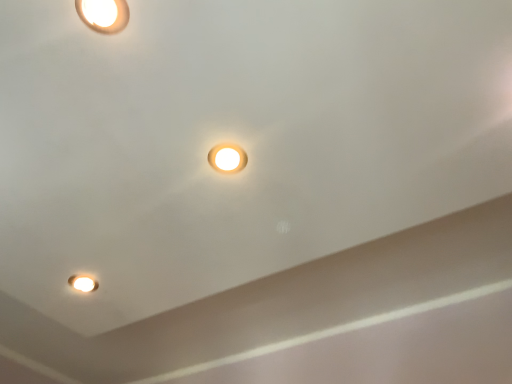
This screenshot has width=512, height=384. Identify the location of matte white light fixture at lower left. (83, 283).

Is matte white lamp at upper left, placed as the first lamp when sorted from front to back, far away from matte white lamp at center, acting as the second lamp starting from the left?

No, matte white lamp at upper left, placed as the first lamp when sorted from front to back, is not far from matte white lamp at center, acting as the second lamp starting from the left.

Does matte white lamp at upper left, which is counted as the 2th lamp, starting from the back, appear on the right side of matte white lamp at center, arranged as the 1th lamp when viewed from the right?

Incorrect, matte white lamp at upper left, which is counted as the 2th lamp, starting from the back, is not on the right side of matte white lamp at center, arranged as the 1th lamp when viewed from the right.

Does matte white lamp at upper left, acting as the 2th lamp starting from the right, have a greater width compared to matte white lamp at center, acting as the second lamp starting from the left?

Yes.

Does matte white lamp at upper left, placed as the first lamp when sorted from front to back, have a greater height compared to matte white lamp at center, arranged as the 1th lamp when viewed from the right?

Correct, matte white lamp at upper left, placed as the first lamp when sorted from front to back, is much taller as matte white lamp at center, arranged as the 1th lamp when viewed from the right.

Does matte white lamp at center, acting as the second lamp starting from the left, have a smaller size compared to matte white light fixture at lower left?

Yes, matte white lamp at center, acting as the second lamp starting from the left, is smaller than matte white light fixture at lower left.

Would you say matte white light fixture at lower left is part of matte white lamp at center, which is the 2th lamp in top-to-bottom order,'s contents?

No, matte white light fixture at lower left is located outside of matte white lamp at center, which is the 2th lamp in top-to-bottom order.

Is matte white lamp at center, arranged as the 1th lamp when viewed from the right, positioned before matte white light fixture at lower left?

That is True.

Is matte white lamp at center, the second lamp positioned from the front, oriented towards matte white light fixture at lower left?

No, matte white lamp at center, the second lamp positioned from the front, does not turn towards matte white light fixture at lower left.

In the image, is matte white lamp at upper left, placed as the first lamp when sorted from front to back, positioned in front of or behind matte white light fixture at lower left?

matte white lamp at upper left, placed as the first lamp when sorted from front to back, is positioned closer to the viewer than matte white light fixture at lower left.

Considering the positions of point (121, 30) and point (74, 286), is point (121, 30) closer or farther from the camera than point (74, 286)?

Point (121, 30) is closer to the camera than point (74, 286).

Is matte white lamp at upper left, the first lamp from the top, bigger or smaller than matte white light fixture at lower left?

Considering their sizes, matte white lamp at upper left, the first lamp from the top, takes up more space than matte white light fixture at lower left.

Where is `lamp that is the 2nd one when counting upward from the matte white light fixture at lower left (from the image's perspective)`? Image resolution: width=512 pixels, height=384 pixels. lamp that is the 2nd one when counting upward from the matte white light fixture at lower left (from the image's perspective) is located at coordinates (104, 14).

Who is taller, matte white light fixture at lower left or matte white lamp at upper left, which appears as the second lamp when ordered from the bottom?

matte white light fixture at lower left.

Considering the sizes of objects matte white light fixture at lower left and matte white lamp at upper left, which appears as the second lamp when ordered from the bottom, in the image provided, who is smaller, matte white light fixture at lower left or matte white lamp at upper left, which appears as the second lamp when ordered from the bottom,?

matte white light fixture at lower left.

From the picture: From a real-world perspective, is matte white light fixture at lower left positioned above or below matte white lamp at upper left, which is counted as the 2th lamp, starting from the back?

Clearly, from a real-world perspective, matte white light fixture at lower left is above matte white lamp at upper left, which is counted as the 2th lamp, starting from the back.

Would you say matte white lamp at center, acting as the second lamp starting from the left, is part of matte white light fixture at lower left's contents?

No.

From the image's perspective, is matte white light fixture at lower left positioned above or below matte white lamp at center, arranged as the 1th lamp when viewed from the right?

From the image's perspective, matte white light fixture at lower left appears below matte white lamp at center, arranged as the 1th lamp when viewed from the right.

Are matte white light fixture at lower left and matte white lamp at center, acting as the second lamp starting from the left, far apart?

No.

Is the depth of matte white light fixture at lower left greater than that of matte white lamp at center, acting as the second lamp starting from the left?

Yes, matte white light fixture at lower left is further from the viewer.

This screenshot has height=384, width=512. I want to click on lamp located above the matte white lamp at center, arranged as the 1th lamp when ordered from the bottom (from a real-world perspective), so click(104, 14).

Which object is wider, matte white lamp at center, which is the 2th lamp in top-to-bottom order, or matte white lamp at upper left, the first lamp from the top?

matte white lamp at upper left, the first lamp from the top, is wider.

Considering the sizes of objects matte white lamp at center, which is the 2th lamp in top-to-bottom order, and matte white lamp at upper left, acting as the 2th lamp starting from the right, in the image provided, who is smaller, matte white lamp at center, which is the 2th lamp in top-to-bottom order, or matte white lamp at upper left, acting as the 2th lamp starting from the right,?

matte white lamp at center, which is the 2th lamp in top-to-bottom order.

Is the surface of matte white lamp at center, positioned as the first lamp in back-to-front order, in direct contact with matte white lamp at upper left, acting as the 2th lamp starting from the right?

No, matte white lamp at center, positioned as the first lamp in back-to-front order, is not in contact with matte white lamp at upper left, acting as the 2th lamp starting from the right.

Where is `lamp above the matte white lamp at center, which is the 2th lamp in top-to-bottom order (from a real-world perspective)`? Image resolution: width=512 pixels, height=384 pixels. lamp above the matte white lamp at center, which is the 2th lamp in top-to-bottom order (from a real-world perspective) is located at coordinates (104, 14).

Find the location of a particular element. The image size is (512, 384). the 1st lamp in front of the matte white light fixture at lower left, starting your count from the anchor is located at coordinates (227, 158).

When comparing their distances from matte white light fixture at lower left, does matte white lamp at center, acting as the second lamp starting from the left, or matte white lamp at upper left, which is counted as the 2th lamp, starting from the back, seem closer?

matte white lamp at center, acting as the second lamp starting from the left.

Estimate the real-world distances between objects in this image. Which object is closer to matte white light fixture at lower left, matte white lamp at upper left, placed as the first lamp when sorted from front to back, or matte white lamp at center, which is the 2th lamp in top-to-bottom order?

matte white lamp at center, which is the 2th lamp in top-to-bottom order, is closer to matte white light fixture at lower left.

Which object lies further to the anchor point matte white lamp at center, which is the 2th lamp in top-to-bottom order, matte white lamp at upper left, acting as the 2th lamp starting from the right, or matte white light fixture at lower left?

Among the two, matte white light fixture at lower left is located further to matte white lamp at center, which is the 2th lamp in top-to-bottom order.

Considering their positions, is matte white light fixture at lower left positioned closer to matte white lamp at upper left, the first lamp from the top, than matte white lamp at center, arranged as the 1th lamp when viewed from the right?

The object closer to matte white lamp at upper left, the first lamp from the top, is matte white lamp at center, arranged as the 1th lamp when viewed from the right.

Considering their positions, is matte white light fixture at lower left positioned closer to matte white lamp at center, positioned as the first lamp in back-to-front order, than matte white lamp at upper left, which is counted as the 2th lamp, starting from the back?

Among the two, matte white lamp at upper left, which is counted as the 2th lamp, starting from the back, is located nearer to matte white lamp at center, positioned as the first lamp in back-to-front order.

Which object lies further to the anchor point matte white lamp at upper left, which appears as the second lamp when ordered from the bottom, matte white lamp at center, arranged as the 1th lamp when viewed from the right, or matte white light fixture at lower left?

matte white light fixture at lower left is further to matte white lamp at upper left, which appears as the second lamp when ordered from the bottom.

This screenshot has width=512, height=384. Find the location of `lamp between matte white lamp at upper left, placed as the first lamp when sorted from front to back, and matte white light fixture at lower left from front to back`. lamp between matte white lamp at upper left, placed as the first lamp when sorted from front to back, and matte white light fixture at lower left from front to back is located at coordinates (227, 158).